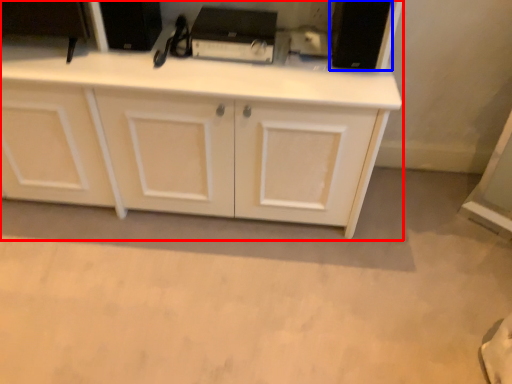
Question: Which point is further to the camera, cabinetry (highlighted by a red box) or appliance (highlighted by a blue box)?

Choices:
 (A) cabinetry
 (B) appliance

Answer: (B)